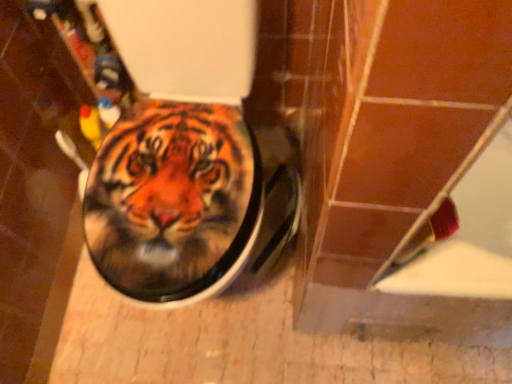
Locate an element on the screen. The image size is (512, 384). matte ceramic toilet seat at center is located at coordinates (190, 201).

This screenshot has height=384, width=512. Describe the element at coordinates (190, 201) in the screenshot. I see `matte ceramic toilet seat at center` at that location.

Measure the distance between matte ceramic toilet seat at center and camera.

They are 31.01 inches apart.

I want to click on matte ceramic toilet seat at center, so click(190, 201).